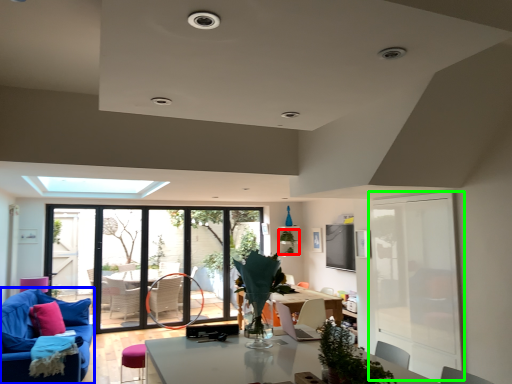
Question: Considering the real-world distances, which object is farthest from plant (highlighted by a red box)? studio couch (highlighted by a blue box) or screen door (highlighted by a green box)?

Choices:
 (A) studio couch
 (B) screen door

Answer: (A)